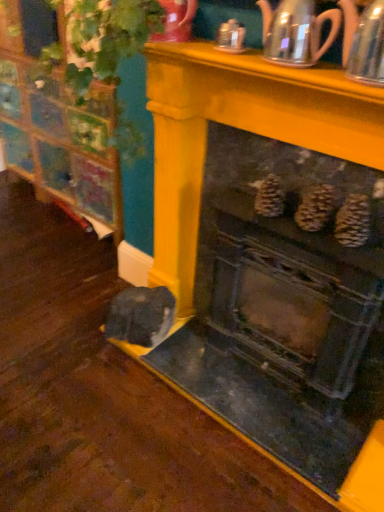
Question: Should I look upward or downward to see metallic silver teapot at upper right, acting as the 2th tea pot starting from the left?

Choices:
 (A) up
 (B) down

Answer: (A)

Question: From the image's perspective, is metallic gray fireplace at center beneath wooden cabinet at left?

Choices:
 (A) yes
 (B) no

Answer: (A)

Question: Is there a large distance between metallic gray fireplace at center and wooden cabinet at left?

Choices:
 (A) no
 (B) yes

Answer: (B)

Question: Is metallic gray fireplace at center to the left of wooden cabinet at left from the viewer's perspective?

Choices:
 (A) yes
 (B) no

Answer: (B)

Question: Is metallic gray fireplace at center oriented away from wooden cabinet at left?

Choices:
 (A) no
 (B) yes

Answer: (A)

Question: Is wooden cabinet at left completely or partially inside metallic gray fireplace at center?

Choices:
 (A) yes
 (B) no

Answer: (B)

Question: Does metallic gray fireplace at center have a greater height compared to wooden cabinet at left?

Choices:
 (A) yes
 (B) no

Answer: (A)

Question: Can we say metallic gray fireplace at center lies outside clear glass teapot at upper center, which appears as the second tea pot when viewed from the right?

Choices:
 (A) yes
 (B) no

Answer: (A)

Question: Can you confirm if metallic gray fireplace at center is smaller than clear glass teapot at upper center, the first tea pot in the left-to-right sequence?

Choices:
 (A) yes
 (B) no

Answer: (B)

Question: Can you confirm if metallic gray fireplace at center is thinner than clear glass teapot at upper center, the first tea pot in the left-to-right sequence?

Choices:
 (A) no
 (B) yes

Answer: (A)

Question: Is the depth of metallic gray fireplace at center greater than that of clear glass teapot at upper center, the first tea pot in the left-to-right sequence?

Choices:
 (A) no
 (B) yes

Answer: (A)

Question: Is metallic gray fireplace at center far away from clear glass teapot at upper center, which appears as the second tea pot when viewed from the right?

Choices:
 (A) yes
 (B) no

Answer: (B)

Question: Is metallic gray fireplace at center bigger than clear glass teapot at upper center, which appears as the second tea pot when viewed from the right?

Choices:
 (A) yes
 (B) no

Answer: (A)

Question: Is metallic gray fireplace at center located within clear glass teapot at upper center, the first tea pot in the left-to-right sequence?

Choices:
 (A) yes
 (B) no

Answer: (B)